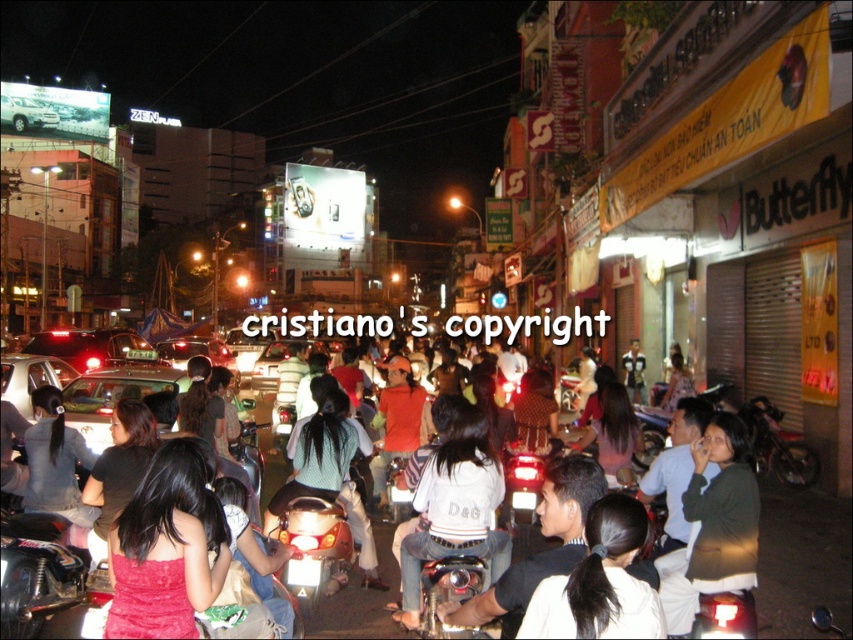
Question: Among these objects, which one is farthest from the camera?

Choices:
 (A) matte black car at center
 (B) denim jacket at lower left
 (C) dark green sweater at center
 (D) black hair at center

Answer: (A)

Question: Does dark brown leather jacket at center have a lesser width compared to silver metallic suv at upper left?

Choices:
 (A) no
 (B) yes

Answer: (A)

Question: Does dark green sweater at center have a lesser width compared to dark brown leather jacket at center?

Choices:
 (A) no
 (B) yes

Answer: (B)

Question: Which of the following is the closest to the observer?

Choices:
 (A) (683, 499)
 (B) (137, 573)
 (C) (469, 544)

Answer: (B)

Question: Is dark green sweater at center to the left of dark brown leather jacket at center from the viewer's perspective?

Choices:
 (A) no
 (B) yes

Answer: (A)

Question: Which of these objects is positioned closest to the denim jacket at center?

Choices:
 (A) denim jacket at lower left
 (B) dark brown leather jacket at center

Answer: (B)